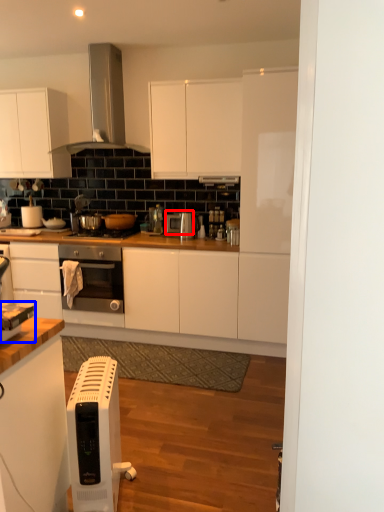
Question: Which object is further to the camera taking this photo, appliance (highlighted by a red box) or appliance (highlighted by a blue box)?

Choices:
 (A) appliance
 (B) appliance

Answer: (A)